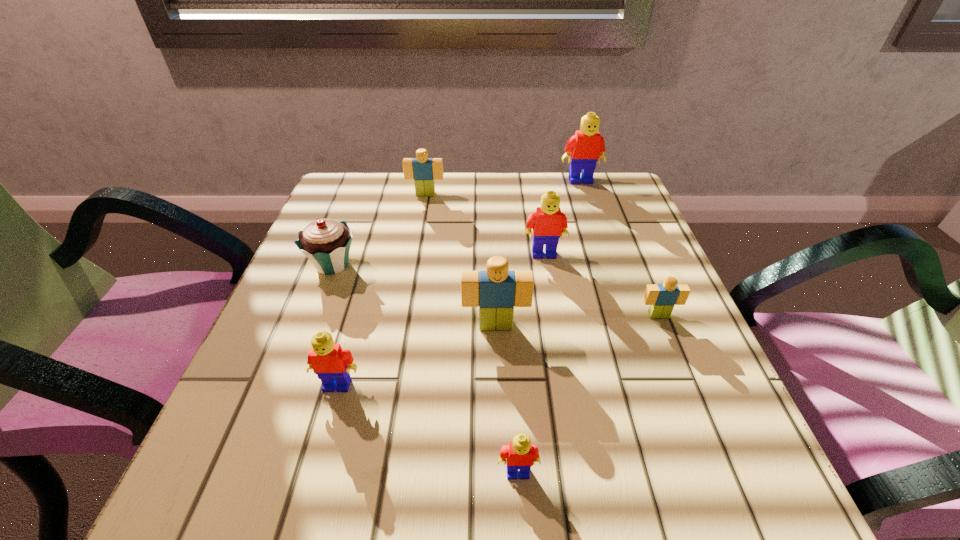
The image size is (960, 540). What are the coordinates of `empty space that is in between the fifth nearest Lego and the nearest object` in the screenshot? It's located at tap(531, 363).

Identify the location of empty space that is in between the rightmost yellow Lego and the smallest beige Lego. (619, 248).

Identify the location of vacant point located between the smallest beige Lego and the farthest yellow Lego. The height and width of the screenshot is (540, 960). (619, 248).

The width and height of the screenshot is (960, 540). Identify the location of free space between the nearest Lego and the biggest beige Lego. (507, 399).

You are a GUI agent. You are given a task and a screenshot of the screen. Output one action in this format:
    pyautogui.click(x=<x>, y=<y>)
    Task: Click on the empty space between the fifth Lego from left to right and the smallest yellow Lego
    
    Given the screenshot: What is the action you would take?
    pyautogui.click(x=531, y=363)

This screenshot has height=540, width=960. Find the location of `vacant area that lies between the tallest Lego and the sixth Lego from right to left`. vacant area that lies between the tallest Lego and the sixth Lego from right to left is located at coordinates [x=503, y=187].

You are a GUI agent. You are given a task and a screenshot of the screen. Output one action in this format:
    pyautogui.click(x=<x>, y=<y>)
    Task: Click on the vacant space that's between the third smallest yellow Lego and the second farthest Lego
    
    Given the screenshot: What is the action you would take?
    pyautogui.click(x=485, y=224)

This screenshot has width=960, height=540. Find the location of `free space that is in between the teal cupcake and the third yellow Lego from left to right`. free space that is in between the teal cupcake and the third yellow Lego from left to right is located at coordinates (439, 260).

Locate an element on the screen. The height and width of the screenshot is (540, 960). free spot between the cupcake and the second beige Lego from left to right is located at coordinates (414, 295).

I want to click on free area in between the tallest Lego and the cupcake, so click(x=457, y=222).